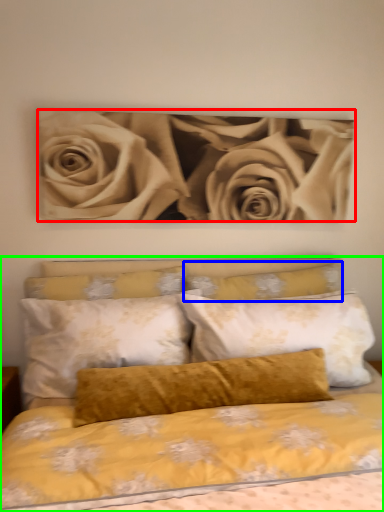
Question: Which object is the closest to the rose (highlighted by a red box)? Choose among these: pillow (highlighted by a blue box) or bed (highlighted by a green box).

Choices:
 (A) pillow
 (B) bed

Answer: (A)